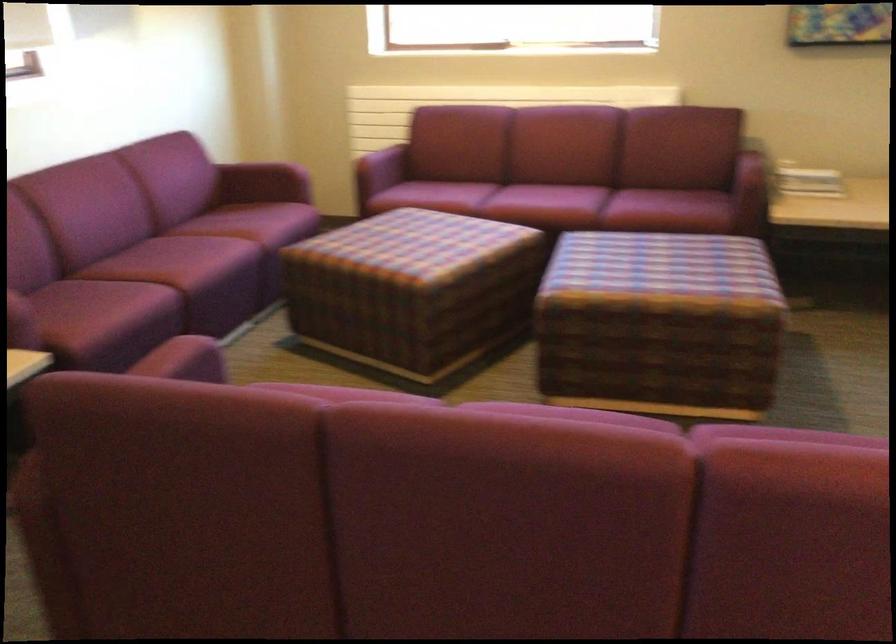
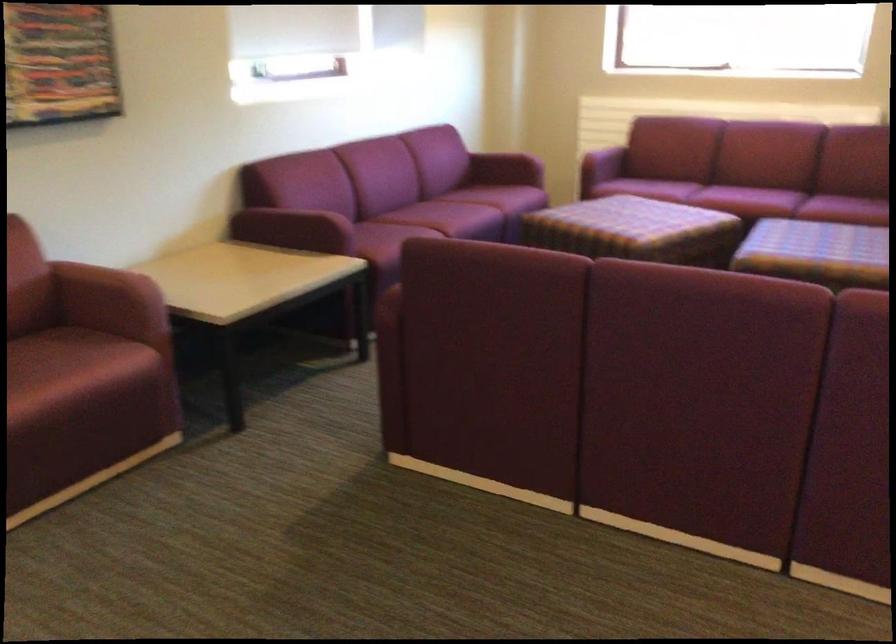
Question: What movement of the cameraman would produce the second image?

Choices:
 (A) Left
 (B) Right
 (C) Forward
 (D) Backward

Answer: (D)